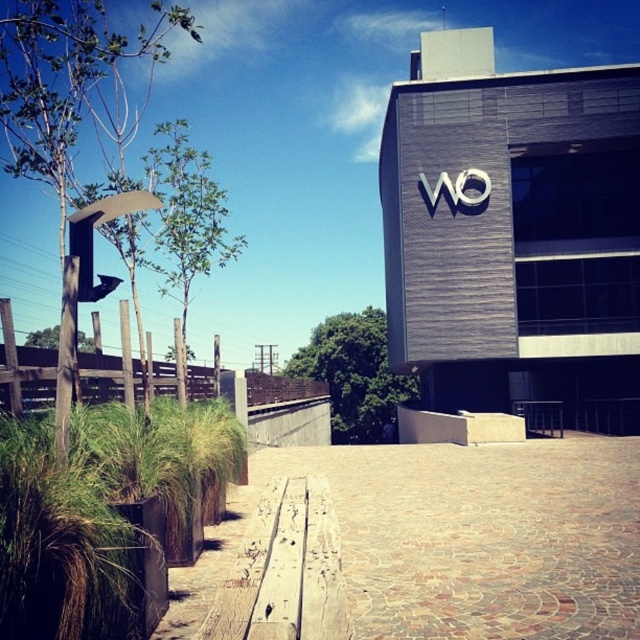
In the scene shown: You are a delivery person trying to park your 2.5 meter long van in the area near the brown textured pavement at center and green grass at lower left. Can you fit your van there?

The brown textured pavement at center is shorter than green grass at lower left, but the exact length of the pavement isn not provided. Without knowing the pavement length, it is impossible to determine if the van will fit.

You are a delivery person trying to park your 1.2 meter wide delivery cart. You see the brown textured pavement at center and the green grass at lower left. Which area can accommodate your cart without damaging the grass?

The brown textured pavement at center might be wider than green grass at lower left, so the cart should be parked on the brown textured pavement at center to avoid damaging the grass.